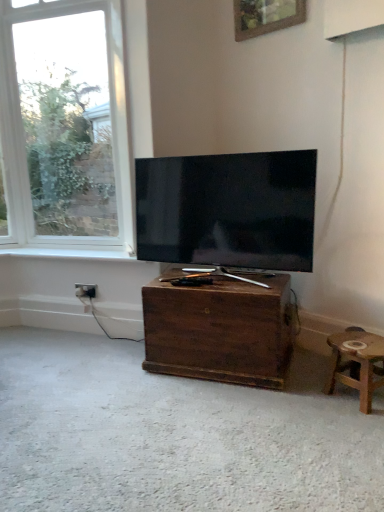
This screenshot has height=512, width=384. What are the coordinates of `vacant point above wooden stool at lower right (from a real-world perspective)` in the screenshot? It's located at pos(362,341).